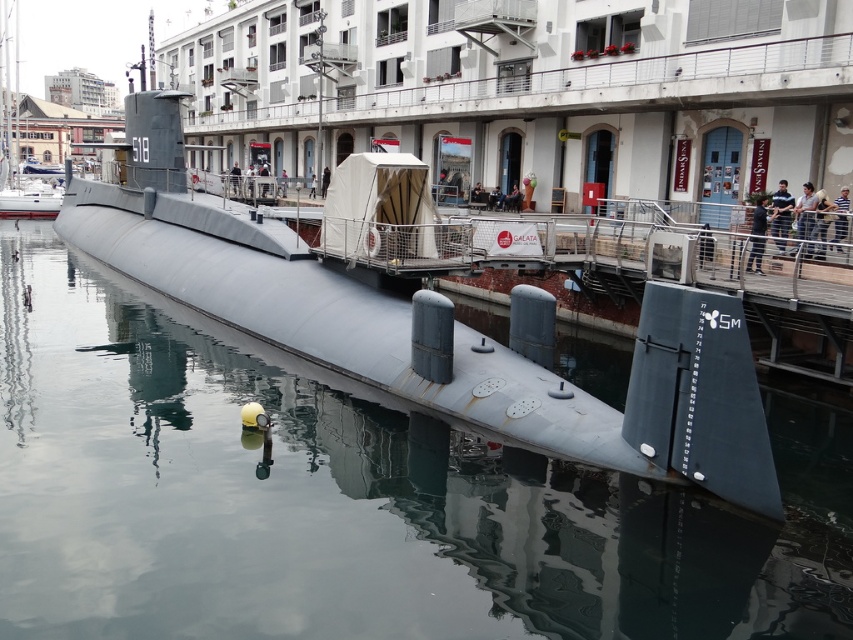
You are an engineer assessing the submarine docked at the waterfront. You need to determine which submarine has a wider width between the glossy metallic submarine at center and the matte gray submarine at center. According to the specifications, which one is wider?

The matte gray submarine at center is wider than the glossy metallic submarine at center according to the description.

From the picture: You are standing on the dock and want to take a photo of the glossy metallic submarine at center. If your camera has a maximum zoom range of 5 meters, will you be able to capture the entire submarine in your photo without moving closer?

The glossy metallic submarine at center is 6.36 meters away from the viewer. Since the camera can only zoom up to 5 meters, you won not be able to capture the entire submarine in your photo without moving closer.